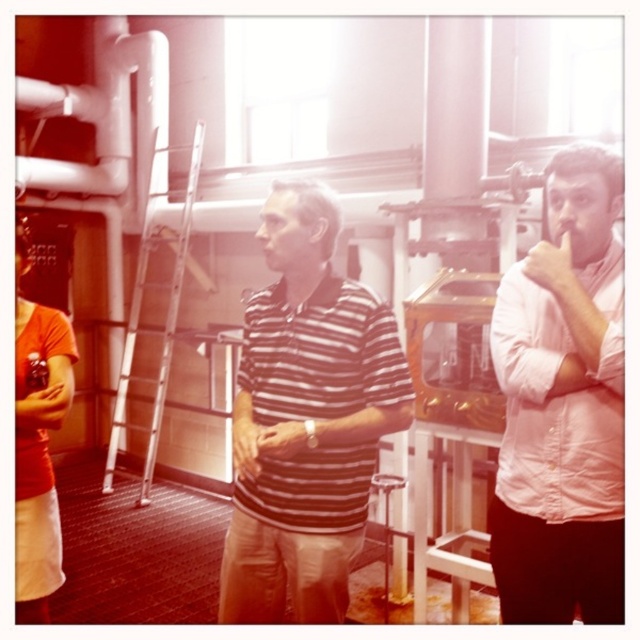
Question: Which of the following is the closest to the observer?

Choices:
 (A) pink cotton shirt at center
 (B) metallic silver ladder at center
 (C) striped cotton shirt at center

Answer: (A)

Question: Which of the following is the farthest from the observer?

Choices:
 (A) (192, 269)
 (B) (323, 620)

Answer: (A)

Question: Is pink cotton shirt at center below metallic silver ladder at center?

Choices:
 (A) no
 (B) yes

Answer: (B)

Question: Which point is farther from the camera taking this photo?

Choices:
 (A) (307, 346)
 (B) (182, 230)
 (C) (586, 244)

Answer: (B)

Question: Where is striped cotton shirt at center located in relation to metallic silver ladder at center in the image?

Choices:
 (A) above
 (B) below

Answer: (B)

Question: Is striped cotton shirt at center to the left of metallic silver ladder at center from the viewer's perspective?

Choices:
 (A) no
 (B) yes

Answer: (A)